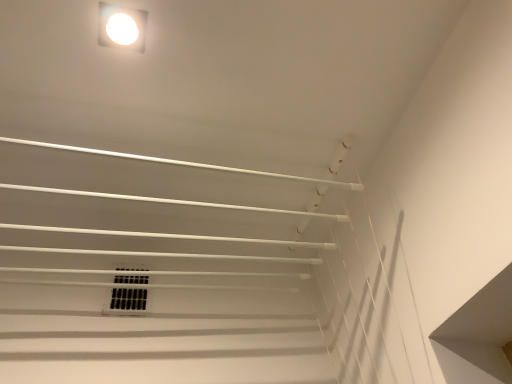
I want to click on white matte light fixture at upper center, so click(122, 27).

The width and height of the screenshot is (512, 384). What do you see at coordinates (122, 27) in the screenshot? I see `white matte light fixture at upper center` at bounding box center [122, 27].

Locate an element on the screen. black plastic vent at center is located at coordinates (128, 296).

Describe the element at coordinates (128, 296) in the screenshot. Image resolution: width=512 pixels, height=384 pixels. I see `black plastic vent at center` at that location.

Measure the distance between point [127,289] and camera.

Point [127,289] is 1.25 meters away from camera.

This screenshot has width=512, height=384. In order to click on white matte light fixture at upper center in this screenshot , I will do `click(122, 27)`.

Can you confirm if black plastic vent at center is positioned to the right of white matte light fixture at upper center?

In fact, black plastic vent at center is to the left of white matte light fixture at upper center.

In the image, is black plastic vent at center positioned in front of or behind white matte light fixture at upper center?

black plastic vent at center is behind white matte light fixture at upper center.

Considering the positions of point (118, 283) and point (106, 38), is point (118, 283) closer or farther from the camera than point (106, 38)?

Point (118, 283).

From the image's perspective, is black plastic vent at center on white matte light fixture at upper center?

No.

From a real-world perspective, is black plastic vent at center over white matte light fixture at upper center?

No, from a real-world perspective, black plastic vent at center is not on top of white matte light fixture at upper center.

Consider the image. Which of these two, black plastic vent at center or white matte light fixture at upper center, is thinner?

black plastic vent at center.

Which of these two, black plastic vent at center or white matte light fixture at upper center, stands taller?

black plastic vent at center.

Which of these two, black plastic vent at center or white matte light fixture at upper center, is smaller?

With smaller size is white matte light fixture at upper center.

From the picture: Is black plastic vent at center completely or partially outside of white matte light fixture at upper center?

Indeed, black plastic vent at center is completely outside white matte light fixture at upper center.

From the picture: Is black plastic vent at center beside white matte light fixture at upper center?

black plastic vent at center and white matte light fixture at upper center are clearly separated.

Is black plastic vent at center oriented away from white matte light fixture at upper center?

That's not correct — black plastic vent at center is not looking away from white matte light fixture at upper center.

How distant is black plastic vent at center from white matte light fixture at upper center?

28.29 inches.

Locate an element on the screen. lamp on the right side of black plastic vent at center is located at coordinates (122, 27).

Does white matte light fixture at upper center appear on the left side of black plastic vent at center?

No, white matte light fixture at upper center is not to the left of black plastic vent at center.

Which object is more forward, white matte light fixture at upper center or black plastic vent at center?

white matte light fixture at upper center is in front.

Which is nearer, (114, 8) or (144, 277)?

The point (114, 8) is more forward.

From the image's perspective, who appears lower, white matte light fixture at upper center or black plastic vent at center?

From the image's view, black plastic vent at center is below.

From a real-world perspective, which is physically above, white matte light fixture at upper center or black plastic vent at center?

white matte light fixture at upper center is physically above.

Considering the sizes of objects white matte light fixture at upper center and black plastic vent at center in the image provided, who is thinner, white matte light fixture at upper center or black plastic vent at center?

With smaller width is black plastic vent at center.

Between white matte light fixture at upper center and black plastic vent at center, which one has more height?

black plastic vent at center is taller.

Which of these two, white matte light fixture at upper center or black plastic vent at center, is bigger?

black plastic vent at center.

Can we say white matte light fixture at upper center lies outside black plastic vent at center?

Absolutely, white matte light fixture at upper center is external to black plastic vent at center.

Would you consider white matte light fixture at upper center to be distant from black plastic vent at center?

They are positioned close to each other.

Is black plastic vent at center at the back of white matte light fixture at upper center?

white matte light fixture at upper center does not have its back to black plastic vent at center.

Find the location of `lamp above the black plastic vent at center (from a real-world perspective)`. lamp above the black plastic vent at center (from a real-world perspective) is located at coordinates (122, 27).

Identify the location of window located below the white matte light fixture at upper center (from the image's perspective). This screenshot has height=384, width=512. (128, 296).

Identify the location of window behind the white matte light fixture at upper center. The height and width of the screenshot is (384, 512). (128, 296).